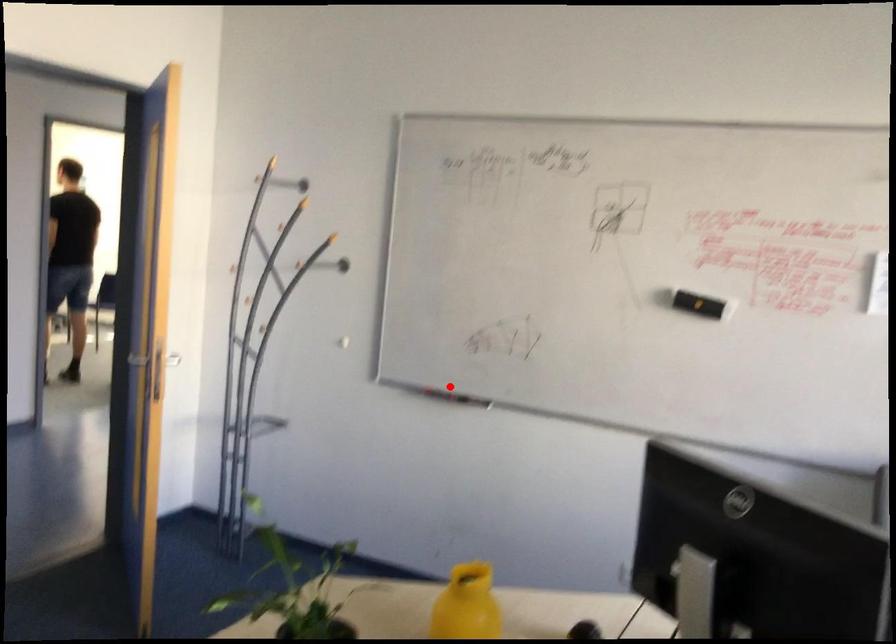
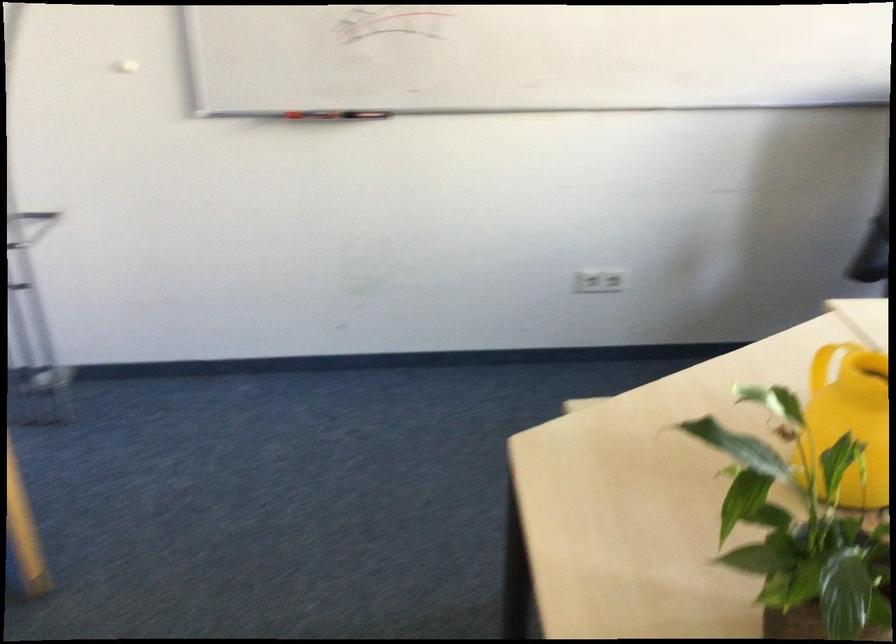
Question: I am providing you with two images of the same scene from different viewpoints. Image1 has a red point marked. In image2, the corresponding 3D location appears at what relative position? Reply with the corresponding letter.

Choices:
 (A) Closer
 (B) Farther

Answer: (A)